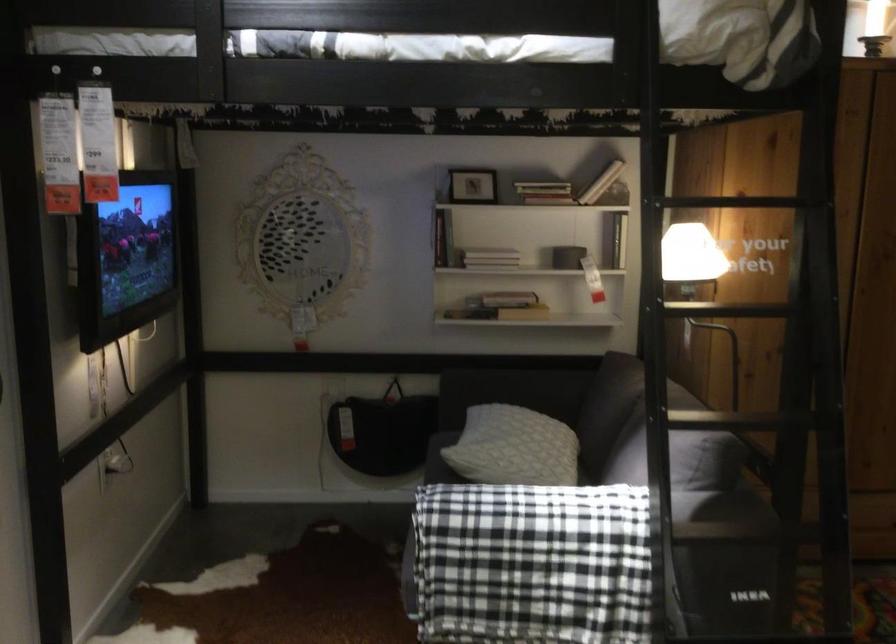
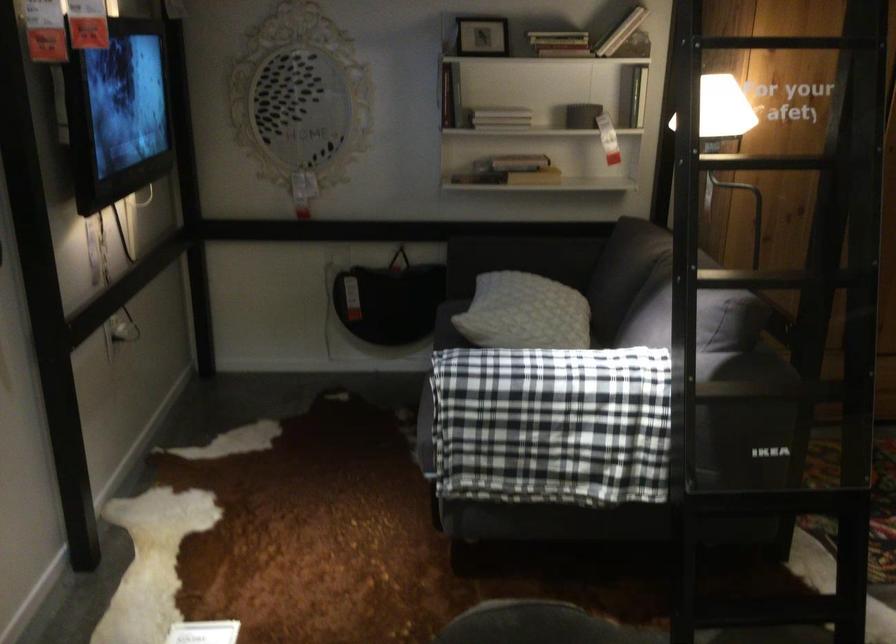
Locate, in the second image, the point that corresponds to point 494,261 in the first image.

(500, 118)